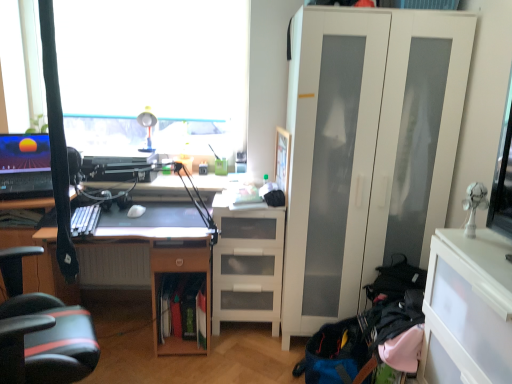
Question: Is transparent plastic cabinet at lower right closer to camera compared to white matte mouse at center?

Choices:
 (A) no
 (B) yes

Answer: (B)

Question: From the image's perspective, is transparent plastic cabinet at lower right over white matte mouse at center?

Choices:
 (A) no
 (B) yes

Answer: (A)

Question: Is transparent plastic cabinet at lower right touching white matte mouse at center?

Choices:
 (A) no
 (B) yes

Answer: (A)

Question: Is transparent plastic cabinet at lower right outside of white matte mouse at center?

Choices:
 (A) yes
 (B) no

Answer: (A)

Question: Is transparent plastic cabinet at lower right at the right side of white matte mouse at center?

Choices:
 (A) no
 (B) yes

Answer: (B)

Question: Would you say wooden desk at center is to the left or to the right of matte plastic table lamp at upper center in the picture?

Choices:
 (A) right
 (B) left

Answer: (B)

Question: In terms of width, does wooden desk at center look wider or thinner when compared to matte plastic table lamp at upper center?

Choices:
 (A) wide
 (B) thin

Answer: (A)

Question: Is point (53, 263) closer or farther from the camera than point (151, 127)?

Choices:
 (A) closer
 (B) farther

Answer: (A)

Question: From the image's perspective, is wooden desk at center positioned above or below matte plastic table lamp at upper center?

Choices:
 (A) above
 (B) below

Answer: (B)

Question: From the image's perspective, is matte plastic table lamp at upper center positioned above or below wooden desk at center?

Choices:
 (A) below
 (B) above

Answer: (B)

Question: From a real-world perspective, is matte plastic table lamp at upper center physically located above or below wooden desk at center?

Choices:
 (A) below
 (B) above

Answer: (B)

Question: Is point (145, 105) closer or farther from the camera than point (53, 258)?

Choices:
 (A) closer
 (B) farther

Answer: (B)

Question: Considering the positions of matte plastic table lamp at upper center and wooden desk at center in the image, is matte plastic table lamp at upper center taller or shorter than wooden desk at center?

Choices:
 (A) short
 (B) tall

Answer: (A)

Question: From a real-world perspective, is white matte mouse at center positioned above or below wooden desk at center?

Choices:
 (A) above
 (B) below

Answer: (A)

Question: Is white matte mouse at center inside or outside of wooden desk at center?

Choices:
 (A) outside
 (B) inside

Answer: (B)